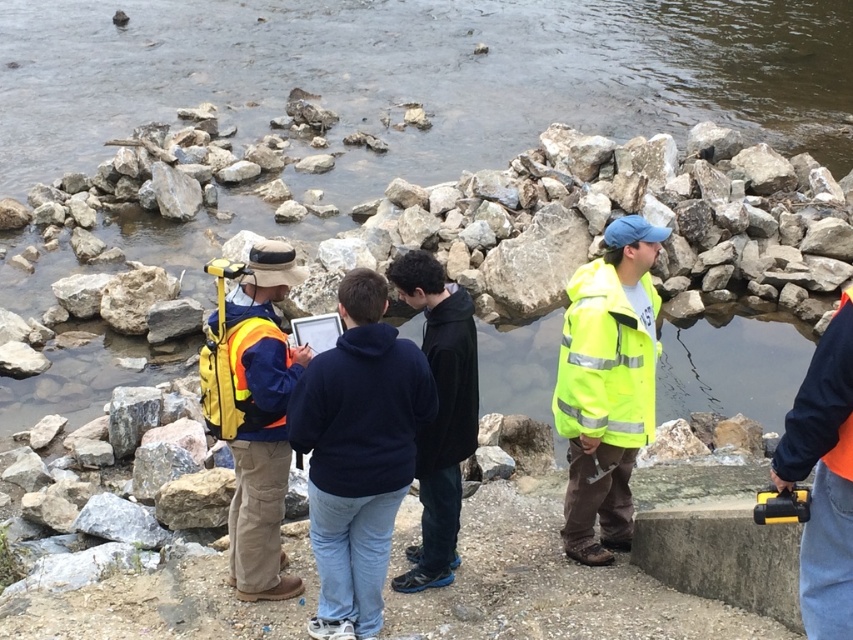
Is orange reflective vest at center below yellow reflective vest at center?

Yes.

Does orange reflective vest at center appear over yellow reflective vest at center?

Incorrect, orange reflective vest at center is not positioned above yellow reflective vest at center.

This screenshot has width=853, height=640. In order to click on orange reflective vest at center in this screenshot , I will do `click(254, 413)`.

Based on the photo, measure the distance between point [219,364] and camera.

They are 20.10 feet apart.

Image resolution: width=853 pixels, height=640 pixels. Describe the element at coordinates (254, 413) in the screenshot. I see `orange reflective vest at center` at that location.

Does point (262, 378) lie behind point (215, 403)?

No, it is not.

Locate an element on the screen. The image size is (853, 640). orange reflective vest at center is located at coordinates (254, 413).

Is dark blue fleece at center thinner than yellow reflective vest at center?

No.

Identify the location of dark blue fleece at center. (358, 452).